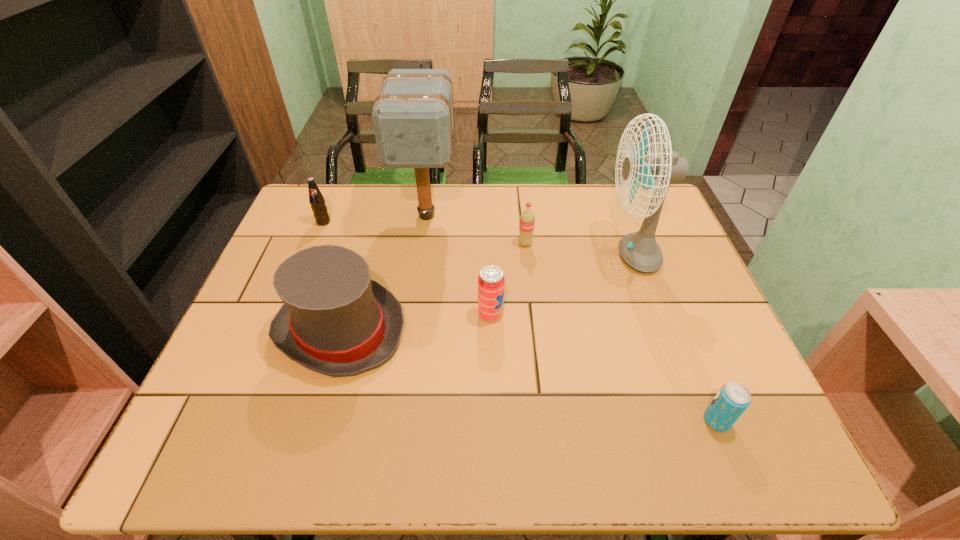
Where is `blank space that satisfies the following two spatial constraints: 1. on the front-facing side of the fan; 2. on the front side of the fourth object from right to left`? This screenshot has width=960, height=540. blank space that satisfies the following two spatial constraints: 1. on the front-facing side of the fan; 2. on the front side of the fourth object from right to left is located at coordinates (653, 314).

At what (x,y) coordinates should I click in order to perform the action: click on free spot that satisfies the following two spatial constraints: 1. on the front label of the leftmost soda can; 2. on the right side of the third tallest object. Please return your answer as a coordinate pair (x, y). Looking at the image, I should click on (280, 330).

I want to click on free point that satisfies the following two spatial constraints: 1. on the front label of the fourth object from right to left; 2. on the left side of the farthest soda can, so click(x=286, y=314).

You are a GUI agent. You are given a task and a screenshot of the screen. Output one action in this format:
    pyautogui.click(x=<x>, y=<y>)
    Task: Click on the vacant region that satisfies the following two spatial constraints: 1. on the striking surface of the mallet; 2. on the right side of the second nearest soda can
    The width and height of the screenshot is (960, 540).
    Given the screenshot: What is the action you would take?
    pyautogui.click(x=413, y=314)

Find the location of a particular element. free location that satisfies the following two spatial constraints: 1. on the front-facing side of the fan; 2. on the front side of the third soda can from right to left is located at coordinates (653, 314).

Locate an element on the screen. vacant space that satisfies the following two spatial constraints: 1. on the striking surface of the fourth object from right to left; 2. on the right side of the mallet is located at coordinates (413, 314).

I want to click on vacant position in the image that satisfies the following two spatial constraints: 1. on the front label of the farthest soda can; 2. on the left side of the third nearest soda can, so click(315, 244).